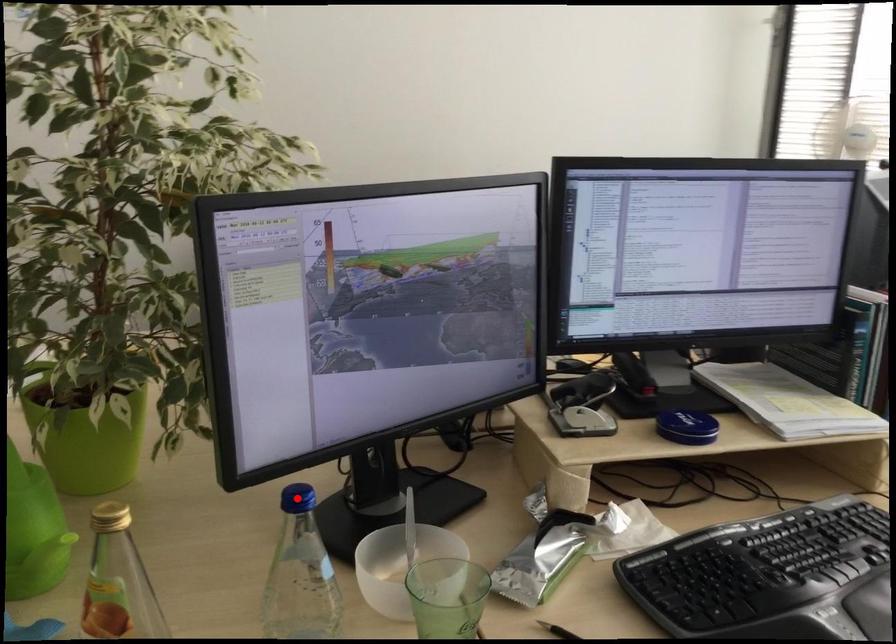
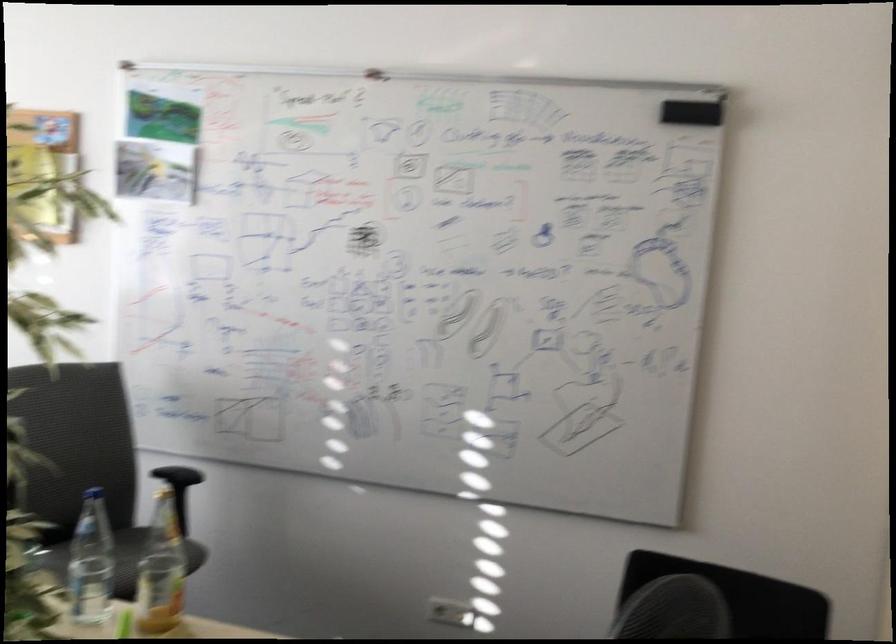
Question: I am providing you with two images of the same scene from different viewpoints. A red point is marked on the first image. Can you still see the location of the red point in image 2?

Choices:
 (A) Yes
 (B) No

Answer: (B)